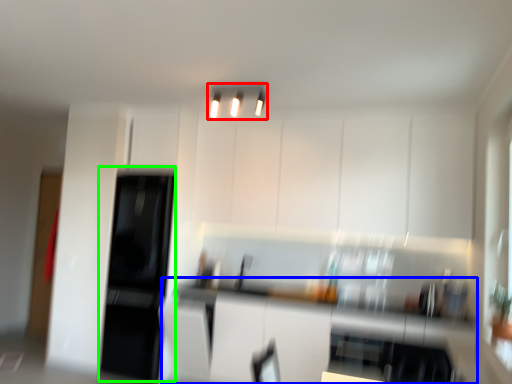
Question: Which object is positioned farthest from light fixture (highlighted by a red box)? Select from counter top (highlighted by a blue box) and appliance (highlighted by a green box).

Choices:
 (A) counter top
 (B) appliance

Answer: (B)